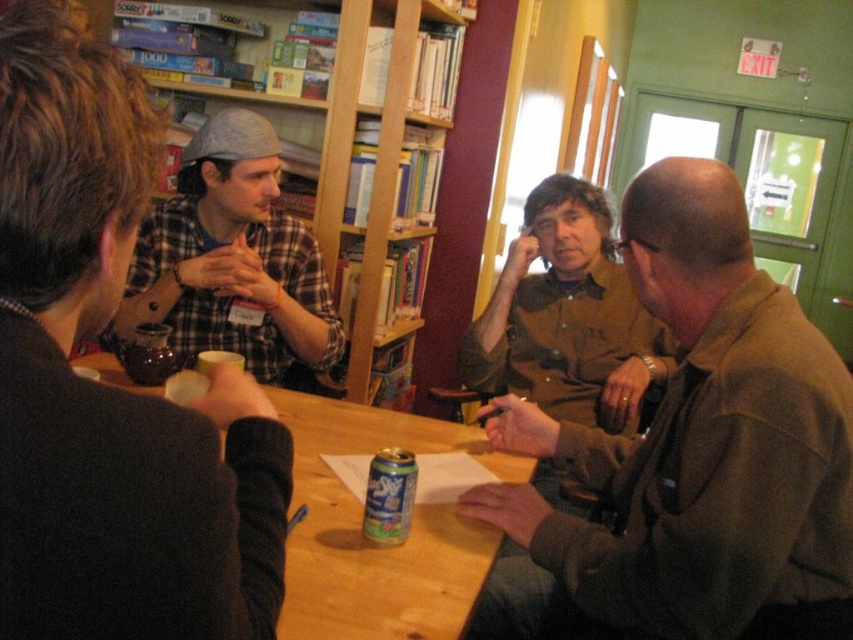
Question: Considering the real-world distances, which object is closest to the brown leather jacket at upper right?

Choices:
 (A) wooden bookshelf at upper center
 (B) wooden table at center
 (C) plaid fabric shirt at upper left

Answer: (B)

Question: Is brown leather jacket at upper right in front of brown matte shirt at center?

Choices:
 (A) no
 (B) yes

Answer: (B)

Question: Can you confirm if brown leather jacket at upper right is positioned above plaid fabric shirt at upper left?

Choices:
 (A) yes
 (B) no

Answer: (B)

Question: Which is farther from the brown leather jacket at upper right?

Choices:
 (A) wooden bookshelf at upper center
 (B) wooden table at center
 (C) brown matte shirt at center

Answer: (A)

Question: Which object is closer to the camera taking this photo?

Choices:
 (A) wooden table at center
 (B) wooden bookshelf at upper center
 (C) brown leather jacket at upper right

Answer: (A)

Question: Does plaid flannel shirt at upper left have a larger size compared to brown matte shirt at center?

Choices:
 (A) yes
 (B) no

Answer: (B)